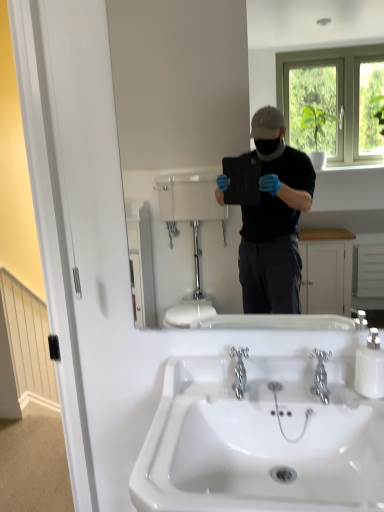
The width and height of the screenshot is (384, 512). What do you see at coordinates (239, 371) in the screenshot?
I see `chrome metallic faucet at center, which is the first plumbing fixture from left to right` at bounding box center [239, 371].

This screenshot has height=512, width=384. What do you see at coordinates (370, 367) in the screenshot? I see `white glossy soap dispenser at right` at bounding box center [370, 367].

What do you see at coordinates (321, 375) in the screenshot? This screenshot has width=384, height=512. I see `polished chrome faucet at center, which is counted as the 2th plumbing fixture, starting from the left` at bounding box center [321, 375].

This screenshot has height=512, width=384. What do you see at coordinates (201, 94) in the screenshot? I see `matte black tablet at center` at bounding box center [201, 94].

The height and width of the screenshot is (512, 384). Describe the element at coordinates (260, 440) in the screenshot. I see `white glossy sink at center` at that location.

Image resolution: width=384 pixels, height=512 pixels. In order to click on chrome metallic faucet at center, which is the first plumbing fixture from left to right in this screenshot , I will do `click(239, 371)`.

Is white glossy sink at center inside the boundaries of chrome metallic faucet at center, the second plumbing fixture from the right, or outside?

The correct answer is: outside.

Measure the distance from white glossy sink at center to chrome metallic faucet at center, the second plumbing fixture from the right.

They are 7.68 inches apart.

Looking at this image, who is taller, white glossy sink at center or chrome metallic faucet at center, the second plumbing fixture from the right?

Standing taller between the two is white glossy sink at center.

Are white glossy sink at center and chrome metallic faucet at center, the second plumbing fixture from the right, making contact?

No, white glossy sink at center is not making contact with chrome metallic faucet at center, the second plumbing fixture from the right.

Who is smaller, polished chrome faucet at center, which is counted as the 2th plumbing fixture, starting from the left, or white glossy soap dispenser at right?

Smaller between the two is polished chrome faucet at center, which is counted as the 2th plumbing fixture, starting from the left.

This screenshot has height=512, width=384. Find the location of `the 2nd plumbing fixture in front of the white glossy soap dispenser at right`. the 2nd plumbing fixture in front of the white glossy soap dispenser at right is located at coordinates (321, 375).

Does polished chrome faucet at center, which ranks as the 1th plumbing fixture in right-to-left order, appear on the right side of white glossy soap dispenser at right?

No, polished chrome faucet at center, which ranks as the 1th plumbing fixture in right-to-left order, is not to the right of white glossy soap dispenser at right.

Considering the points (321, 373) and (357, 379), which point is in front, point (321, 373) or point (357, 379)?

The point (321, 373) is closer.

Considering the positions of point (374, 0) and point (246, 497), is point (374, 0) closer or farther from the camera than point (246, 497)?

Point (374, 0) is positioned farther from the camera compared to point (246, 497).

From a real-world perspective, does matte black tablet at center stand above white glossy sink at center?

Yes, from a real-world perspective, matte black tablet at center is on top of white glossy sink at center.

Does matte black tablet at center lie in front of white glossy sink at center?

That is False.

Considering the sizes of objects matte black tablet at center and white glossy sink at center in the image provided, who is smaller, matte black tablet at center or white glossy sink at center?

matte black tablet at center.

From the image's perspective, count 2nd plumbing fixtures downward from the matte black tablet at center and point to it. Please provide its 2D coordinates.

[(239, 371)]

Which object is closer to the camera, chrome metallic faucet at center, the second plumbing fixture from the right, or matte black tablet at center?

Positioned in front is matte black tablet at center.

Is chrome metallic faucet at center, which is the first plumbing fixture from left to right, bigger than matte black tablet at center?

Incorrect, chrome metallic faucet at center, which is the first plumbing fixture from left to right, is not larger than matte black tablet at center.

Is chrome metallic faucet at center, the second plumbing fixture from the right, with matte black tablet at center?

chrome metallic faucet at center, the second plumbing fixture from the right, is not next to matte black tablet at center, and they're not touching.

Who is smaller, matte black tablet at center or chrome metallic faucet at center, the second plumbing fixture from the right?

chrome metallic faucet at center, the second plumbing fixture from the right.

You are a GUI agent. You are given a task and a screenshot of the screen. Output one action in this format:
    pyautogui.click(x=<x>, y=<y>)
    Task: Click on the mirror in front of the chrome metallic faucet at center, the second plumbing fixture from the right
    This screenshot has height=512, width=384.
    Given the screenshot: What is the action you would take?
    pyautogui.click(x=201, y=94)

Is matte black tablet at center next to chrome metallic faucet at center, the second plumbing fixture from the right?

No, matte black tablet at center is not touching chrome metallic faucet at center, the second plumbing fixture from the right.

Would you say white glossy soap dispenser at right is to the left or to the right of chrome metallic faucet at center, the second plumbing fixture from the right, in the picture?

From the image, it's evident that white glossy soap dispenser at right is to the right of chrome metallic faucet at center, the second plumbing fixture from the right.

Which point is more distant from viewer, (356, 378) or (230, 355)?

The point (230, 355) is behind.

Is chrome metallic faucet at center, the second plumbing fixture from the right, a part of white glossy soap dispenser at right?

Actually, chrome metallic faucet at center, the second plumbing fixture from the right, is outside white glossy soap dispenser at right.

Is white glossy sink at center spatially inside white glossy soap dispenser at right, or outside of it?

white glossy sink at center is not inside white glossy soap dispenser at right, it's outside.

Looking at this image, considering the sizes of objects white glossy sink at center and white glossy soap dispenser at right in the image provided, who is bigger, white glossy sink at center or white glossy soap dispenser at right?

Bigger between the two is white glossy sink at center.

Between white glossy sink at center and white glossy soap dispenser at right, which one has more height?

Standing taller between the two is white glossy sink at center.

You are a GUI agent. You are given a task and a screenshot of the screen. Output one action in this format:
    pyautogui.click(x=<x>, y=<y>)
    Task: Click on the sink located in front of the chrome metallic faucet at center, which is the first plumbing fixture from left to right
    The image size is (384, 512).
    Given the screenshot: What is the action you would take?
    pyautogui.click(x=260, y=440)

Find the location of a particular element. This screenshot has width=384, height=512. bottle that is above the polished chrome faucet at center, which ranks as the 1th plumbing fixture in right-to-left order (from the image's perspective) is located at coordinates (370, 367).

Based on their spatial positions, is chrome metallic faucet at center, which is the first plumbing fixture from left to right, or white glossy soap dispenser at right further from white glossy sink at center?

Among the two, white glossy soap dispenser at right is located further to white glossy sink at center.

Consider the image. Estimate the real-world distances between objects in this image. Which object is closer to white glossy soap dispenser at right, white glossy sink at center or matte black tablet at center?

white glossy sink at center lies closer to white glossy soap dispenser at right than the other object.

Considering their positions, is white glossy soap dispenser at right positioned closer to matte black tablet at center than chrome metallic faucet at center, which is the first plumbing fixture from left to right?

The object closer to matte black tablet at center is chrome metallic faucet at center, which is the first plumbing fixture from left to right.

Estimate the real-world distances between objects in this image. Which object is closer to chrome metallic faucet at center, the second plumbing fixture from the right, matte black tablet at center or polished chrome faucet at center, which ranks as the 1th plumbing fixture in right-to-left order?

polished chrome faucet at center, which ranks as the 1th plumbing fixture in right-to-left order, is closer to chrome metallic faucet at center, the second plumbing fixture from the right.

Considering their positions, is white glossy soap dispenser at right positioned further to polished chrome faucet at center, which is counted as the 2th plumbing fixture, starting from the left, than matte black tablet at center?

Based on the image, matte black tablet at center appears to be further to polished chrome faucet at center, which is counted as the 2th plumbing fixture, starting from the left.

Considering their positions, is white glossy soap dispenser at right positioned closer to matte black tablet at center than white glossy sink at center?

white glossy sink at center is positioned closer to the anchor matte black tablet at center.

Based on their spatial positions, is white glossy soap dispenser at right or chrome metallic faucet at center, the second plumbing fixture from the right, further from white glossy sink at center?

The object further to white glossy sink at center is white glossy soap dispenser at right.

From the image, which object appears to be nearer to white glossy sink at center, polished chrome faucet at center, which ranks as the 1th plumbing fixture in right-to-left order, or chrome metallic faucet at center, the second plumbing fixture from the right?

Based on the image, chrome metallic faucet at center, the second plumbing fixture from the right, appears to be nearer to white glossy sink at center.

This screenshot has width=384, height=512. I want to click on bottle between matte black tablet at center and polished chrome faucet at center, which is counted as the 2th plumbing fixture, starting from the left, in the vertical direction, so click(x=370, y=367).

At what (x,y) coordinates should I click in order to perform the action: click on plumbing fixture between white glossy sink at center and chrome metallic faucet at center, which is the first plumbing fixture from left to right, along the z-axis. Please return your answer as a coordinate pair (x, y). The image size is (384, 512). Looking at the image, I should click on (321, 375).

At what (x,y) coordinates should I click in order to perform the action: click on bottle between matte black tablet at center and chrome metallic faucet at center, the second plumbing fixture from the right, in the up-down direction. Please return your answer as a coordinate pair (x, y). The width and height of the screenshot is (384, 512). Looking at the image, I should click on (370, 367).

You are a GUI agent. You are given a task and a screenshot of the screen. Output one action in this format:
    pyautogui.click(x=<x>, y=<y>)
    Task: Click on the bottle between matte black tablet at center and white glossy sink at center from top to bottom
    The image size is (384, 512).
    Given the screenshot: What is the action you would take?
    pyautogui.click(x=370, y=367)